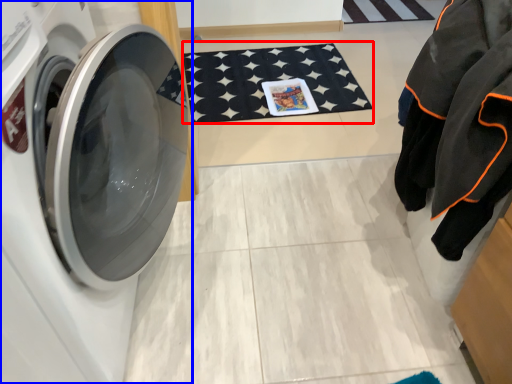
Question: Among these objects, which one is nearest to the camera, bath mat (highlighted by a red box) or washing machine (highlighted by a blue box)?

Choices:
 (A) bath mat
 (B) washing machine

Answer: (B)